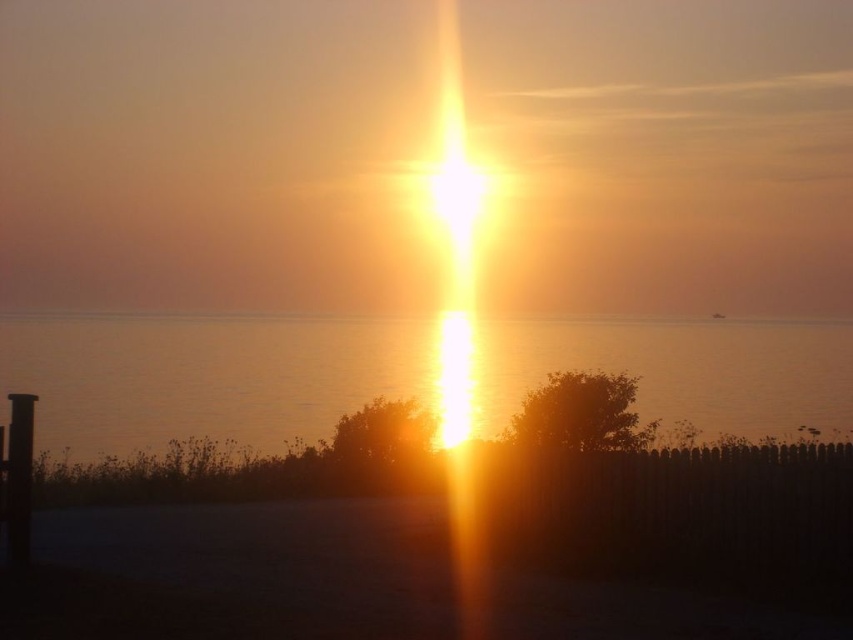
You are a photographer setting up equipment for the sunset. You have a camera on a tripod and need to position it so that both the silvery water at center and the black matte pole at left are visible in the frame. Based on their relative sizes in the image, which object will appear larger in your photo?

The silvery water at center will appear larger in the photo because it is much taller than the black matte pole at left.

You are a photographer setting up a tripod to capture the sunset. You have the silvery water at center and the black matte pole at left in your viewfinder. Which object should you focus on first to ensure both are in sharp focus?

You should focus on the black matte pole at left first because it is behind the silvery water at center, so focusing on the farther object first can help ensure both are in focus when using depth of field techniques.

You are standing on the shore of the lake and see the silvery water at center and the black matte pole at left. Which object is closer to your right side?

The black matte pole at left is closer to your right side because the silvery water at center is to the left of it.